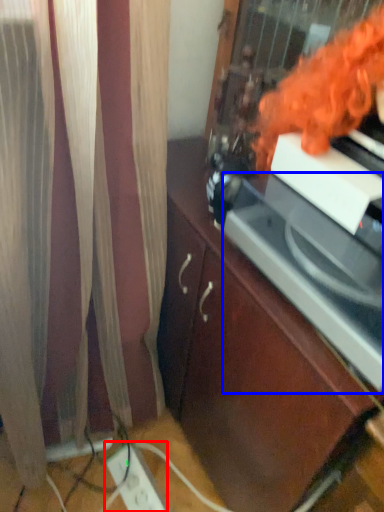
Question: Which object appears closest to the camera in this image, extension cord (highlighted by a red box) or appliance (highlighted by a blue box)?

Choices:
 (A) extension cord
 (B) appliance

Answer: (B)